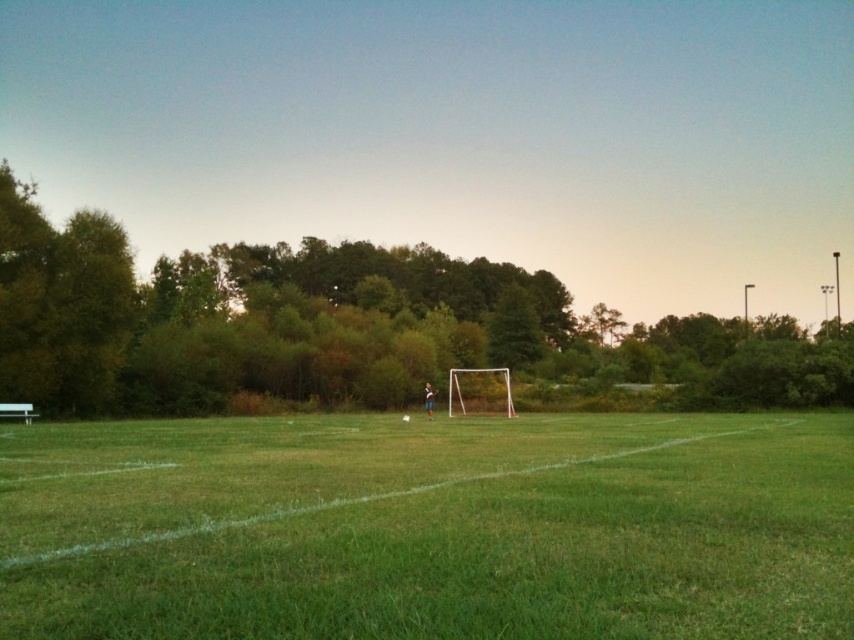
Question: Where is green grass at center located in relation to green leafy tree at center in the image?

Choices:
 (A) below
 (B) above

Answer: (A)

Question: Which of the following is the closest to the observer?

Choices:
 (A) (177, 410)
 (B) (480, 381)

Answer: (A)

Question: Is green leafy tree at center smaller than white plastic goal at center?

Choices:
 (A) no
 (B) yes

Answer: (A)

Question: Is green grass at center to the right of white plastic goal at center from the viewer's perspective?

Choices:
 (A) no
 (B) yes

Answer: (A)

Question: Which object is positioned closest to the green leafy tree at center?

Choices:
 (A) white plastic goal at center
 (B) green grass at center

Answer: (A)

Question: Considering the real-world distances, which object is closest to the white plastic goal at center?

Choices:
 (A) green grass at center
 (B) green leafy tree at center

Answer: (A)